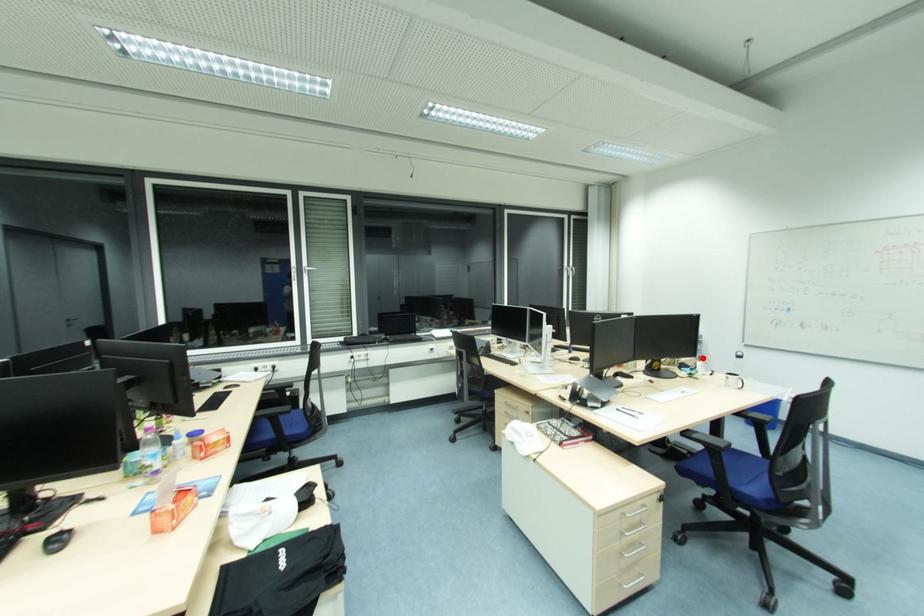
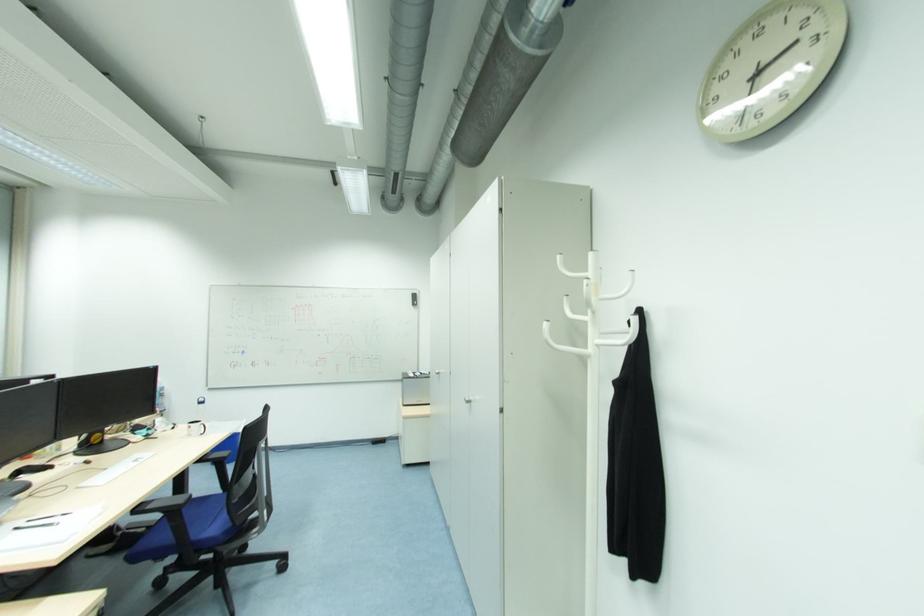
Locate, in the second image, the point that corresponds to the highlighted location in the first image.

(164, 413)